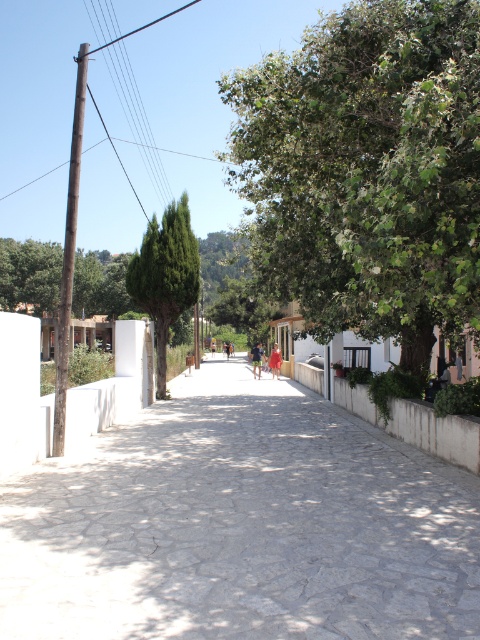
Is green leafy tree at center above green matte tree at center?

Yes, green leafy tree at center is above green matte tree at center.

Can you confirm if green leafy tree at center is smaller than green matte tree at center?

Actually, green leafy tree at center might be larger than green matte tree at center.

Between point (391, 52) and point (163, 321), which one is positioned behind?

The point (163, 321) is behind.

Identify the location of green leafy tree at center. Image resolution: width=480 pixels, height=640 pixels. (368, 172).

Which is more to the right, gray stone path at center or green leafy tree at center?

Positioned to the right is green leafy tree at center.

The height and width of the screenshot is (640, 480). What do you see at coordinates (240, 525) in the screenshot?
I see `gray stone path at center` at bounding box center [240, 525].

Where is `gray stone path at center`? gray stone path at center is located at coordinates coord(240,525).

Does gray stone path at center have a smaller size compared to green matte tree at center?

Yes.

Who is more forward, (405, 582) or (175, 269)?

Point (405, 582) is more forward.

The image size is (480, 640). I want to click on gray stone path at center, so click(240, 525).